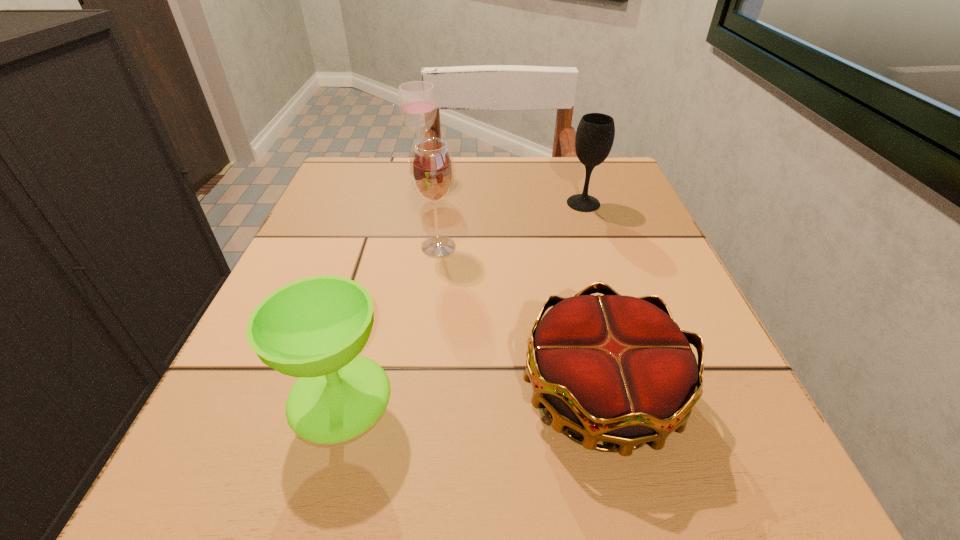
Where is `free space at the far edge`? The height and width of the screenshot is (540, 960). free space at the far edge is located at coordinates (530, 195).

The width and height of the screenshot is (960, 540). Identify the location of vacant space at the near edge of the desktop. (333, 456).

This screenshot has height=540, width=960. Identify the location of vacant space at the left edge. (312, 224).

The width and height of the screenshot is (960, 540). In the image, there is a desktop. In order to click on free space at the right edge in this screenshot , I will do `click(707, 380)`.

Where is `vacant space at the far left corner of the desktop`? This screenshot has width=960, height=540. vacant space at the far left corner of the desktop is located at coordinates (371, 166).

Identify the location of vacant region at the near right corner. (708, 477).

Find the location of a particular element. This screenshot has width=960, height=540. empty space that is in between the farthest object and the third farthest object is located at coordinates (431, 212).

Locate an element on the screen. unoccupied area between the second farthest wineglass and the farthest object is located at coordinates (504, 190).

Identify the location of free point between the farthest object and the second nearest wineglass. The image size is (960, 540). (431, 212).

You are a GUI agent. You are given a task and a screenshot of the screen. Output one action in this format:
    pyautogui.click(x=<x>, y=<y>)
    Task: Click on the free spot between the third nearest wineglass and the third nearest object
    This screenshot has height=540, width=960.
    Given the screenshot: What is the action you would take?
    pyautogui.click(x=511, y=225)